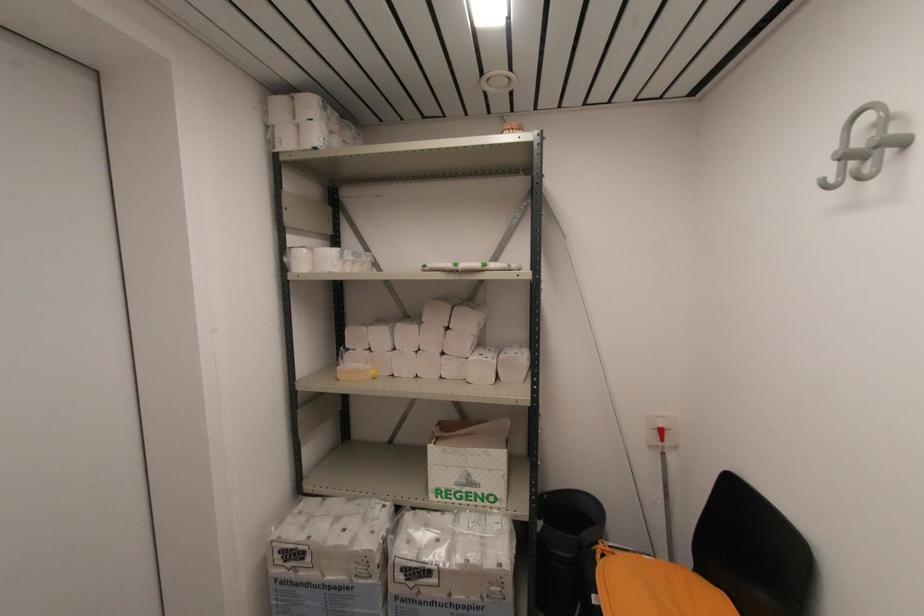
Where would you hang the grey wall hook? Please return your answer as a coordinate pair (x, y).

(864, 148)